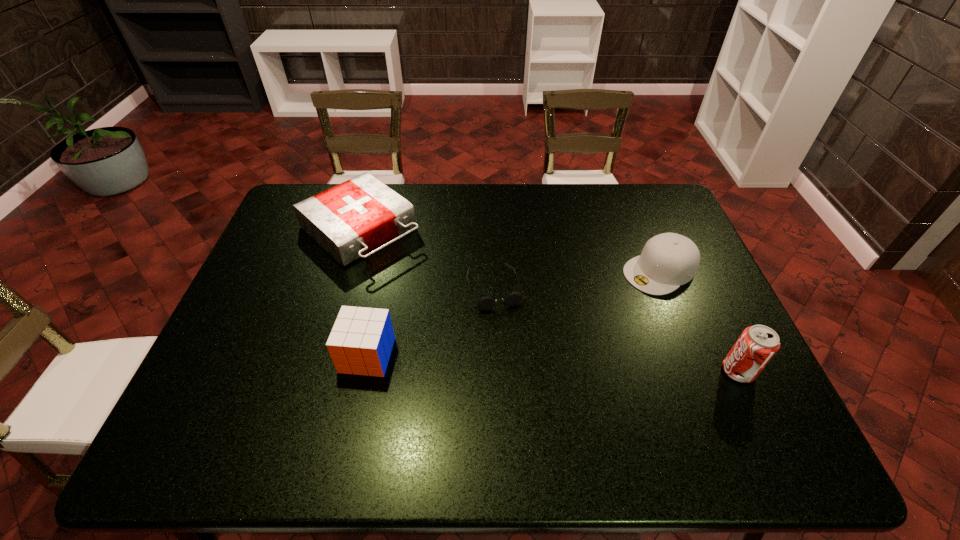
Where is `free space on the desktop that is between the cube and the soda can and is positioned on the front side of the first-aid kit`? This screenshot has height=540, width=960. free space on the desktop that is between the cube and the soda can and is positioned on the front side of the first-aid kit is located at coordinates (520, 362).

This screenshot has width=960, height=540. In order to click on vacant space on the desktop that is between the cube and the soda can and is positioned on the front-facing side of the shortest object in this screenshot , I will do `click(518, 362)`.

The width and height of the screenshot is (960, 540). What are the coordinates of `free space on the desktop that is between the second tallest object and the soda can and is positioned on the front-facing side of the cap` in the screenshot? It's located at (502, 361).